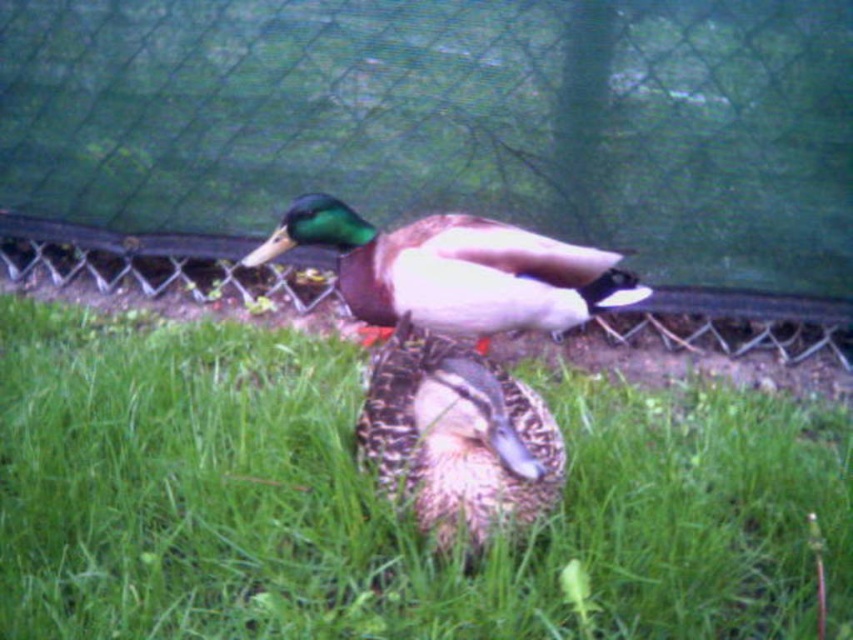
Is green mesh fence at center positioned in front of green glossy duck at center?

No, green mesh fence at center is further to the viewer.

Does point (601, 20) come behind point (372, 314)?

Yes, point (601, 20) is farther from viewer.

The image size is (853, 640). Find the location of `green mesh fence at center`. green mesh fence at center is located at coordinates (451, 122).

Which of these two, green grass at center or green glossy duck at center, stands taller?

green grass at center

Does green grass at center have a lesser width compared to green glossy duck at center?

In fact, green grass at center might be wider than green glossy duck at center.

You are a GUI agent. You are given a task and a screenshot of the screen. Output one action in this format:
    pyautogui.click(x=<x>, y=<y>)
    Task: Click on the green grass at center
    This screenshot has height=640, width=853.
    Given the screenshot: What is the action you would take?
    pyautogui.click(x=381, y=500)

Image resolution: width=853 pixels, height=640 pixels. In order to click on green grass at center in this screenshot , I will do `click(381, 500)`.

Which is more to the right, green grass at center or speckled feather duck at center?

speckled feather duck at center is more to the right.

Find the location of a particular element. Image resolution: width=853 pixels, height=640 pixels. green grass at center is located at coordinates (381, 500).

You are a GUI agent. You are given a task and a screenshot of the screen. Output one action in this format:
    pyautogui.click(x=<x>, y=<y>)
    Task: Click on the green grass at center
    
    Given the screenshot: What is the action you would take?
    pyautogui.click(x=381, y=500)